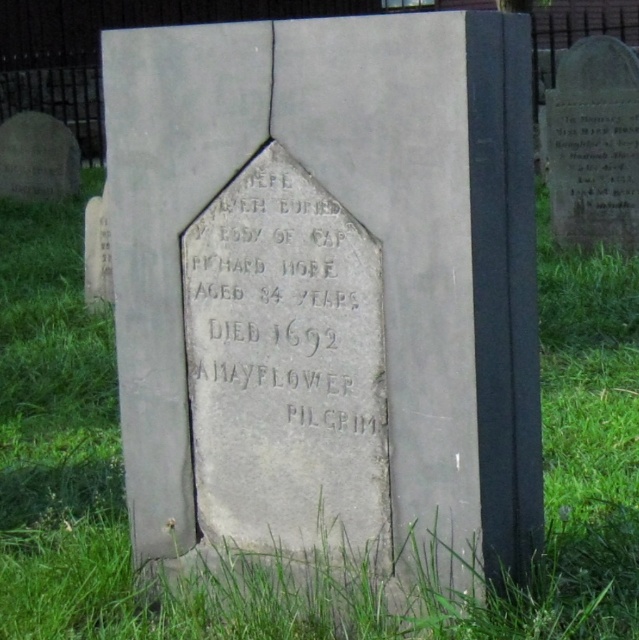
Question: Which point is farther to the camera?

Choices:
 (A) (316, 278)
 (B) (606, 218)

Answer: (B)

Question: Which point is farther to the camera?

Choices:
 (A) gray stone inscription at center
 (B) gray stone gravestone at upper right

Answer: (B)

Question: Is gray stone inscription at center positioned in front of gray stone gravestone at upper right?

Choices:
 (A) no
 (B) yes

Answer: (B)

Question: Does gray stone inscription at center appear under gray stone gravestone at upper right?

Choices:
 (A) yes
 (B) no

Answer: (A)

Question: Can you confirm if gray stone inscription at center is smaller than gray stone gravestone at upper right?

Choices:
 (A) no
 (B) yes

Answer: (B)